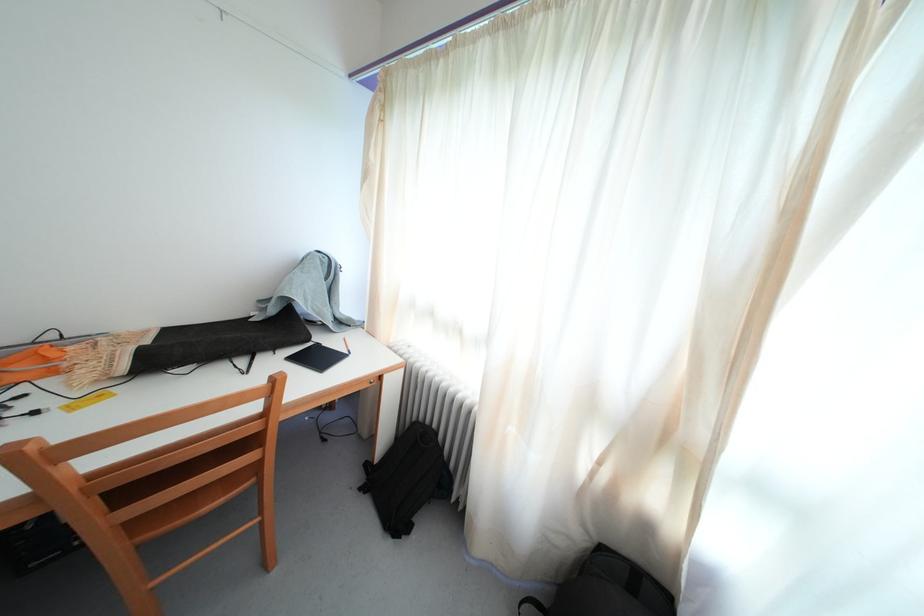
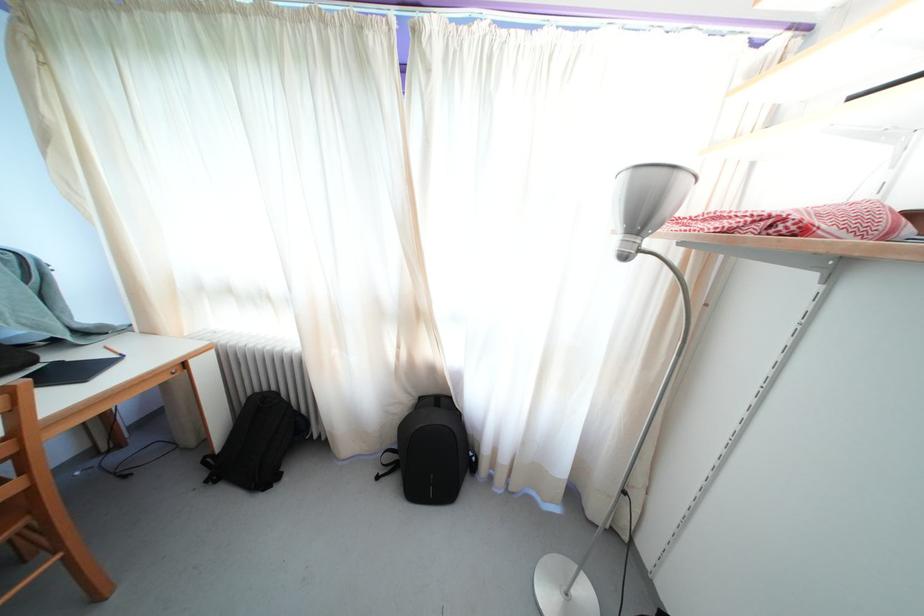
Locate, in the second image, the point that corresponds to point (403, 529) in the first image.

(271, 485)